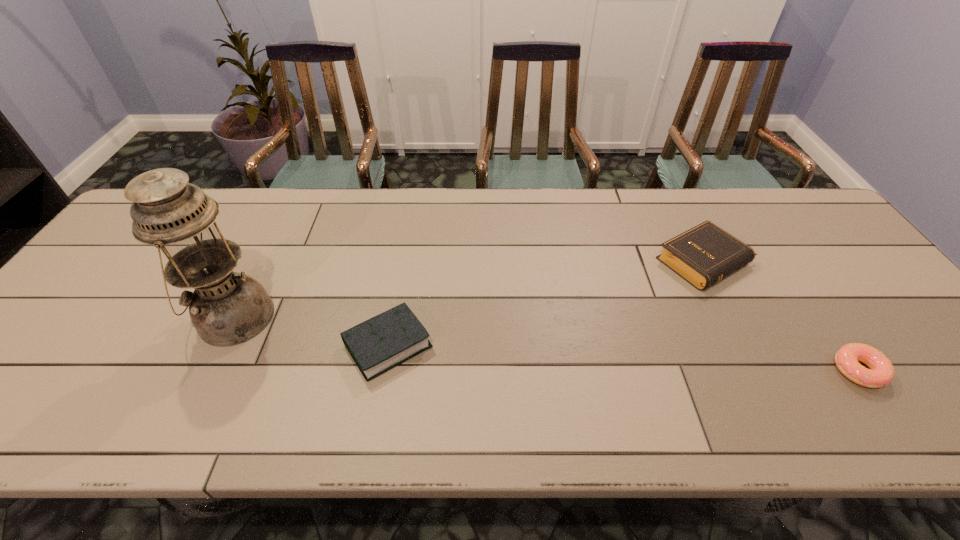
I want to click on free space that satisfies the following two spatial constraints: 1. on the front side of the tallest object; 2. on the right side of the rightmost object, so click(x=208, y=370).

I want to click on vacant area that satisfies the following two spatial constraints: 1. on the back side of the tallest object; 2. on the left side of the third object from left to right, so (262, 261).

I want to click on vacant region that satisfies the following two spatial constraints: 1. on the front side of the doughnut; 2. on the right side of the nearer Bible, so click(384, 370).

The image size is (960, 540). I want to click on vacant position in the image that satisfies the following two spatial constraints: 1. on the front side of the oil lamp; 2. on the right side of the doughnut, so click(x=208, y=370).